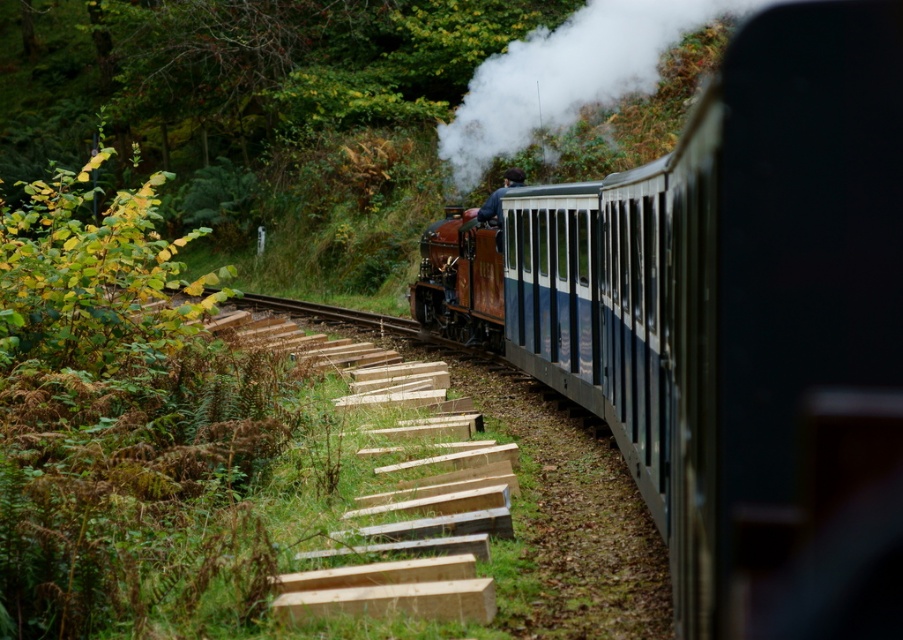
Question: Can you confirm if blue polished wood train at center is positioned to the right of white smoke at upper center?

Choices:
 (A) no
 (B) yes

Answer: (A)

Question: Which object is closer to the camera taking this photo?

Choices:
 (A) blue polished wood train at center
 (B) rusty metal steam engine at center
 (C) white smoke at upper center

Answer: (A)

Question: Considering the relative positions of blue polished wood train at center and white smoke at upper center in the image provided, where is blue polished wood train at center located with respect to white smoke at upper center?

Choices:
 (A) below
 (B) above

Answer: (A)

Question: Can you confirm if blue polished wood train at center is positioned above white smoke at upper center?

Choices:
 (A) yes
 (B) no

Answer: (B)

Question: Which of these objects is positioned farthest from the white smoke at upper center?

Choices:
 (A) blue polished wood train at center
 (B) rusty metal steam engine at center

Answer: (A)

Question: Which point appears farthest from the camera in this image?

Choices:
 (A) (720, 630)
 (B) (430, 257)

Answer: (B)